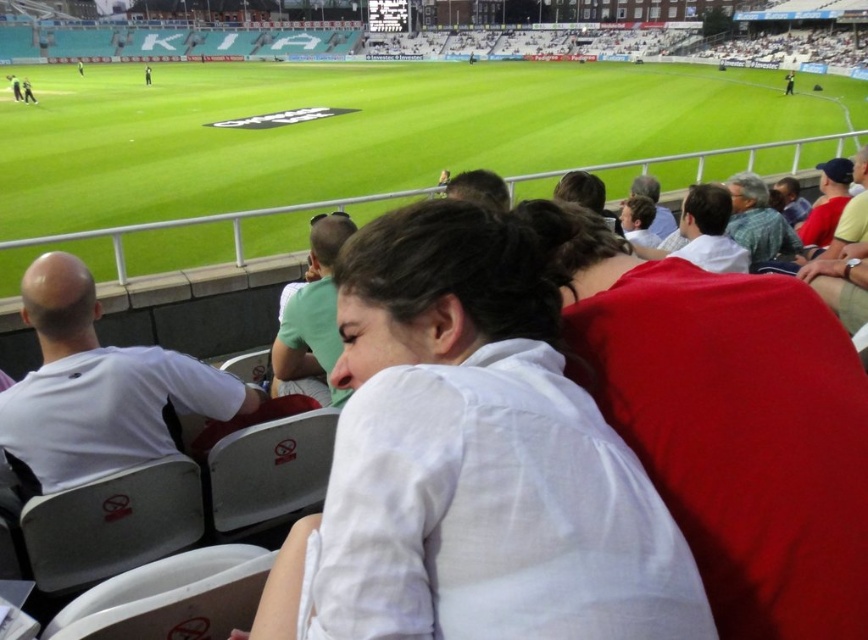
Question: From the image, what is the correct spatial relationship of white cotton shirt at center in relation to green grass football field at center?

Choices:
 (A) above
 (B) below

Answer: (B)

Question: Which of the following is the closest to the observer?

Choices:
 (A) (366, 163)
 (B) (543, 276)

Answer: (B)

Question: Observing the image, what is the correct spatial positioning of white cotton shirt at center in reference to green grass football field at center?

Choices:
 (A) above
 (B) below

Answer: (B)

Question: Among these objects, which one is farthest from the camera?

Choices:
 (A) green grass football field at center
 (B) white cotton shirt at center

Answer: (A)

Question: Can you confirm if white cotton shirt at center is thinner than green grass football field at center?

Choices:
 (A) no
 (B) yes

Answer: (B)